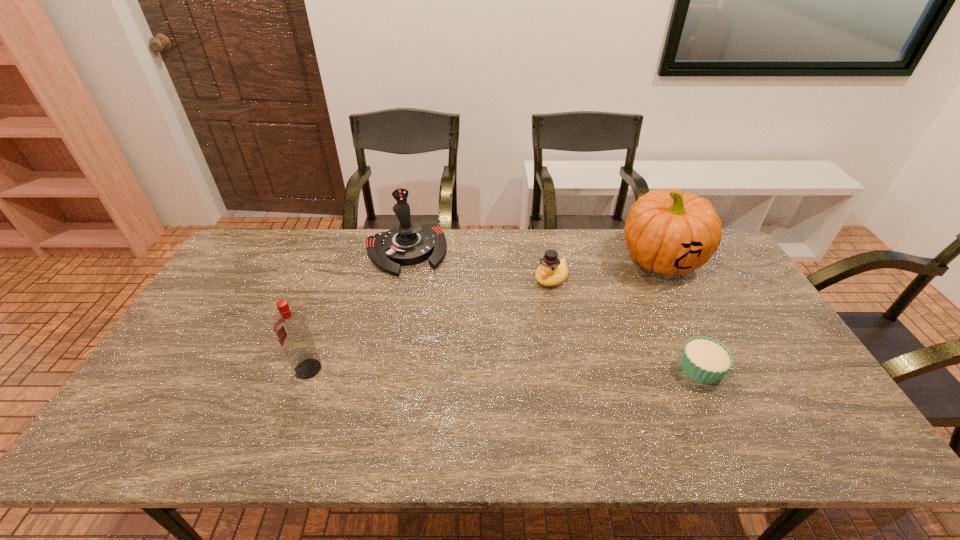
Where is `vacant space that is in between the cupcake and the vodka`? Image resolution: width=960 pixels, height=540 pixels. vacant space that is in between the cupcake and the vodka is located at coordinates (504, 369).

Find the location of a particular element. The image size is (960, 540). unoccupied area between the vodka and the joystick is located at coordinates (356, 310).

This screenshot has height=540, width=960. In order to click on the third closest object relative to the vodka in this screenshot , I will do `click(667, 232)`.

Locate which object ranks fourth in proximity to the duck. Please provide its 2D coordinates. Your answer should be formatted as a tuple, i.e. [(x, y)], where the tuple contains the x and y coordinates of a point satisfying the conditions above.

[(292, 330)]